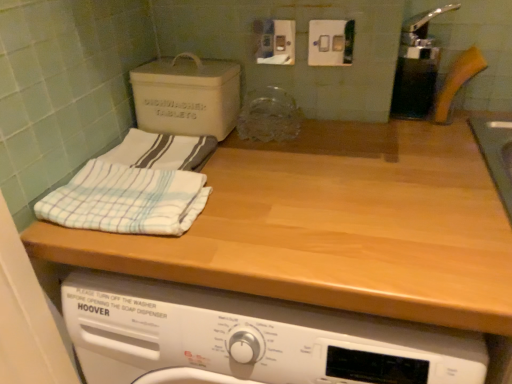
This screenshot has width=512, height=384. Identify the location of vacant area located to the right-hand side of matte gray cardboard box at upper left. (289, 130).